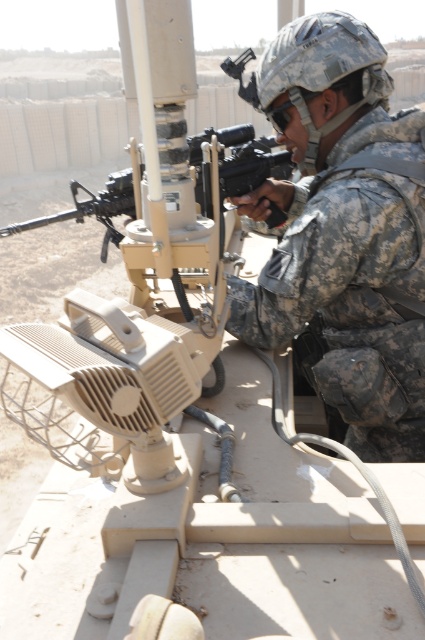
You are a military equipment inspector checking the gear of a soldier. You notice the camouflage fabric helmet at upper right and the matte black rifle at center. Which object is larger in size?

The camouflage fabric helmet at upper right is bigger than the matte black rifle at center according to the description.

The soldier is wearing a camouflage fabric helmet at upper right and holding a matte black rifle at center. Which object is taller?

The camouflage fabric helmet at upper right is taller than the matte black rifle at center.